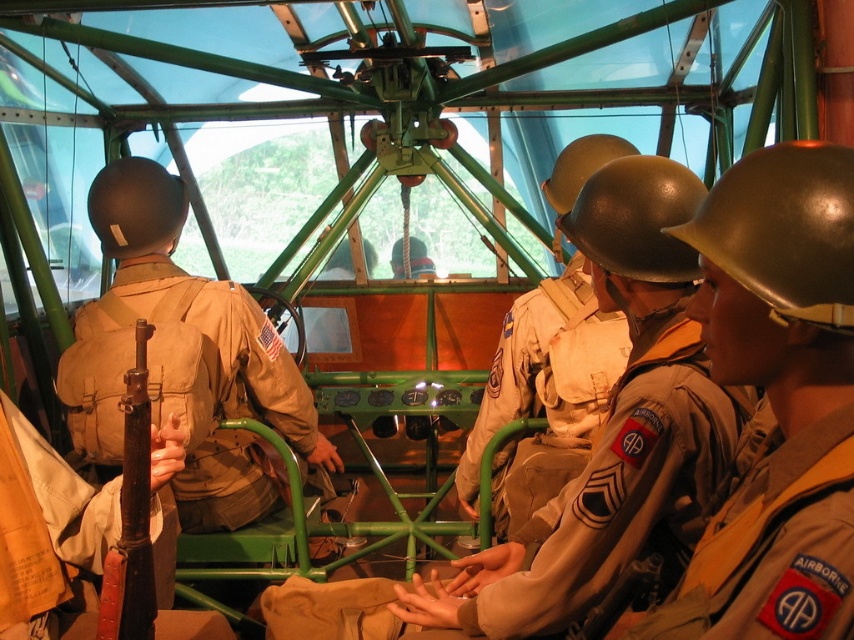
Does point (852, 520) come behind point (501, 484)?

No, it is not.

Between shiny silver helmet at center and tan/khaki fabric uniform at center, which one is positioned higher?

Positioned higher is shiny silver helmet at center.

Is point (784, 461) more distant than point (569, 449)?

No, (784, 461) is closer to viewer.

Find the location of a particular element. Image resolution: width=854 pixels, height=640 pixels. shiny silver helmet at center is located at coordinates [x=776, y=401].

Is tan fabric uniform at center smaller than tan canvas uniform at center?

Correct, tan fabric uniform at center occupies less space than tan canvas uniform at center.

The height and width of the screenshot is (640, 854). What do you see at coordinates (623, 484) in the screenshot? I see `tan fabric uniform at center` at bounding box center [623, 484].

Does point (659, 467) come closer to viewer compared to point (250, 397)?

That is True.

Image resolution: width=854 pixels, height=640 pixels. Identify the location of tan fabric uniform at center. (623, 484).

Locate an element on the screen. The height and width of the screenshot is (640, 854). tan canvas uniform at center is located at coordinates (190, 385).

The image size is (854, 640). I want to click on tan canvas uniform at center, so click(x=190, y=385).